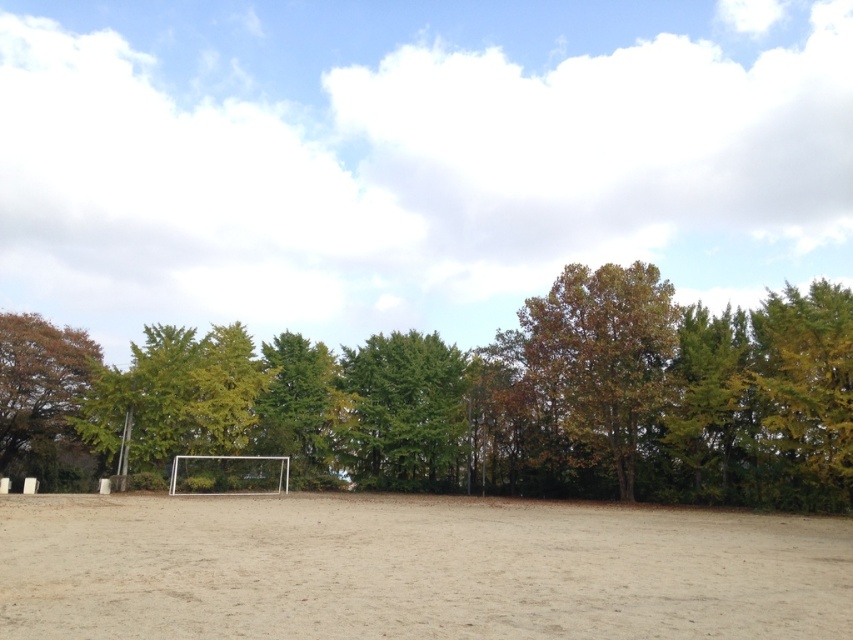
Does brown sandy ground at center lie behind brown/leathery tree at right?

No, brown sandy ground at center is closer to the viewer.

Which of these two, brown sandy ground at center or brown/leathery tree at right, stands shorter?

With less height is brown sandy ground at center.

Describe the element at coordinates (415, 570) in the screenshot. I see `brown sandy ground at center` at that location.

Image resolution: width=853 pixels, height=640 pixels. Find the location of `brown sandy ground at center`. brown sandy ground at center is located at coordinates (415, 570).

Who is taller, brown leafy tree at center or green leafy tree at center?

With more height is brown leafy tree at center.

Is brown leafy tree at center below green leafy tree at center?

No, brown leafy tree at center is not below green leafy tree at center.

Between point (54, 337) and point (409, 364), which one is positioned behind?

The point (409, 364) is more distant.

Identify the location of brown leafy tree at center. (469, 401).

Is brown sandy ground at center above green leafy tree at center?

No.

Consider the image. Is brown sandy ground at center below green leafy tree at center?

Yes, brown sandy ground at center is below green leafy tree at center.

At what (x,y) coordinates should I click in order to perform the action: click on brown sandy ground at center. Please return your answer as a coordinate pair (x, y). The width and height of the screenshot is (853, 640). Looking at the image, I should click on (415, 570).